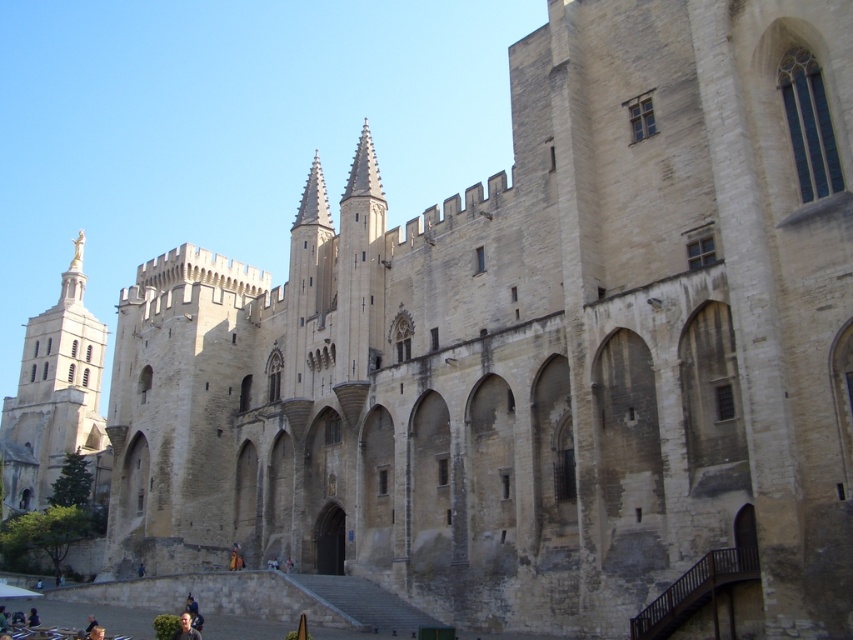
From the picture: You are an architect examining the medieval building. You notice the golden statue at left and the light brown leather jacket at lower center. Which object is larger in size?

The golden statue at left is bigger than the light brown leather jacket at lower center.

From the picture: You are an architect examining the medieval building and notice the golden statue at left and the light brown leather jacket at lower center. Based on their sizes, which object would you estimate to be taller?

The golden statue at left is taller than the light brown leather jacket at lower center according to the description.